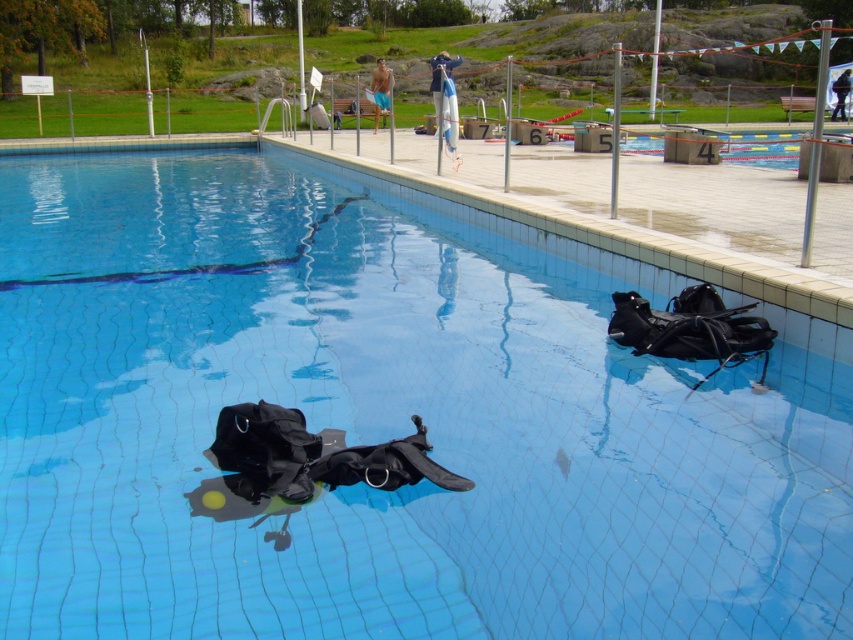
Question: Where is blue fabric shorts at upper center located in relation to black fabric backpack at lower center in the image?

Choices:
 (A) left
 (B) right

Answer: (A)

Question: Which object is farther from the camera taking this photo?

Choices:
 (A) black fabric backpack at lower center
 (B) blue fabric shorts at upper center

Answer: (A)

Question: In this image, where is blue fabric shorts at upper center located relative to black fabric backpack at lower center?

Choices:
 (A) below
 (B) above

Answer: (B)

Question: Which object appears closest to the camera in this image?

Choices:
 (A) blue fabric shorts at upper center
 (B) black fabric backpack at lower center

Answer: (A)

Question: Is blue fabric shorts at upper center positioned at the back of black fabric backpack at lower center?

Choices:
 (A) no
 (B) yes

Answer: (A)